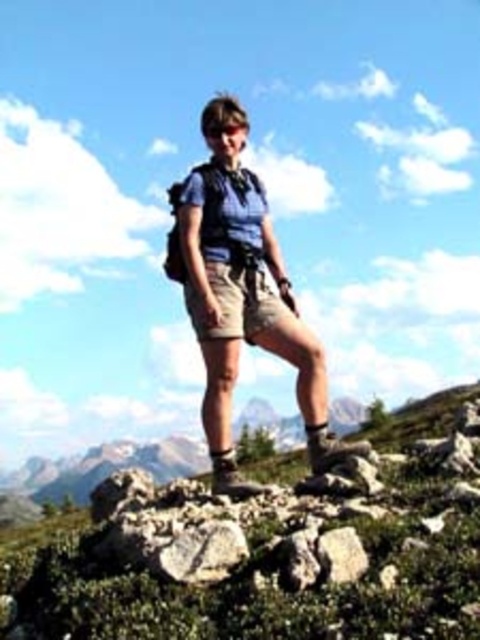
Question: Can you confirm if khaki cotton shorts at center is positioned to the right of leather at right?

Choices:
 (A) yes
 (B) no

Answer: (B)

Question: Which object is farther from the camera taking this photo?

Choices:
 (A) brown suede hiking boot at lower center
 (B) khaki cotton shorts at center

Answer: (B)

Question: Which point is closer to the camera taking this photo?

Choices:
 (A) (364, 454)
 (B) (230, 324)

Answer: (B)

Question: Is khaki cotton shorts at center below leather at right?

Choices:
 (A) no
 (B) yes

Answer: (A)

Question: Is leather at right below brown suede hiking boot at lower center?

Choices:
 (A) no
 (B) yes

Answer: (B)

Question: Which object is positioned farthest from the leather at right?

Choices:
 (A) brown suede hiking boot at lower center
 (B) khaki cotton shorts at center

Answer: (A)